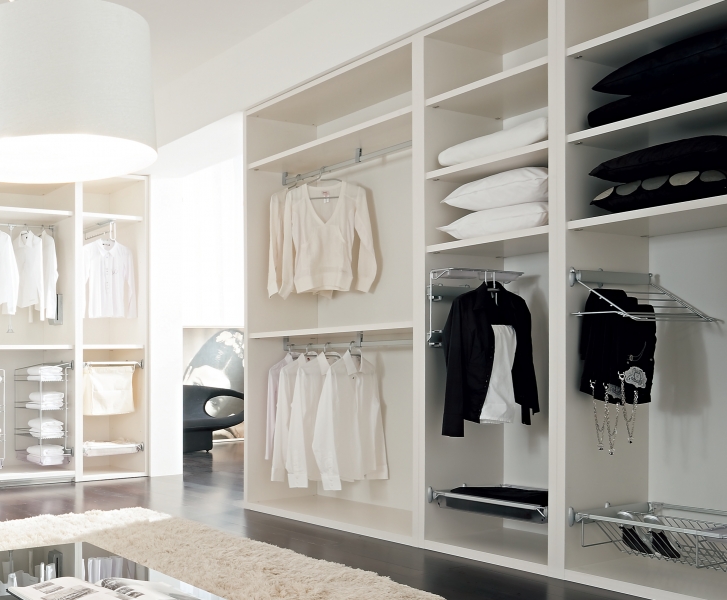
Where is `mounted racks`? Image resolution: width=727 pixels, height=600 pixels. mounted racks is located at coordinates (17, 377).